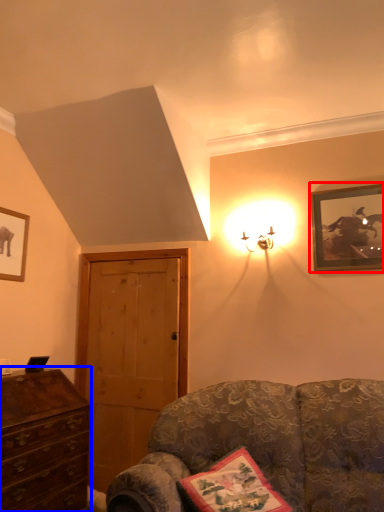
Question: Among these objects, which one is nearest to the camera, picture frame (highlighted by a red box) or chest of drawers (highlighted by a blue box)?

Choices:
 (A) picture frame
 (B) chest of drawers

Answer: (B)